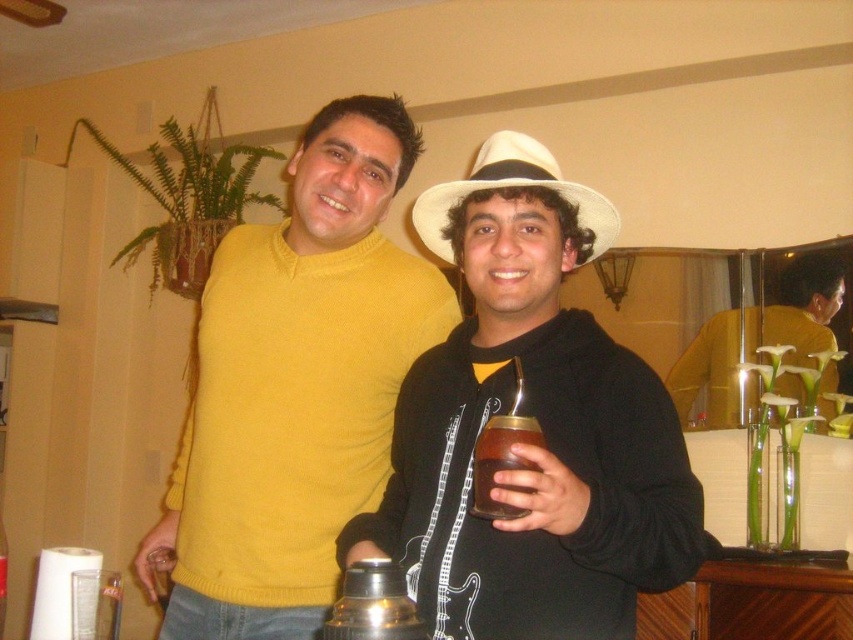
Can you confirm if matte yellow sweater at center is smaller than yellow sweater at center?

Incorrect, matte yellow sweater at center is not smaller in size than yellow sweater at center.

Describe the element at coordinates (294, 387) in the screenshot. I see `matte yellow sweater at center` at that location.

This screenshot has height=640, width=853. Identify the location of matte yellow sweater at center. (294, 387).

Between point (206, 422) and point (508, 468), which one is positioned behind?

The point (206, 422) is more distant.

Is point (404, 337) positioned after point (509, 419)?

That is True.

You are a GUI agent. You are given a task and a screenshot of the screen. Output one action in this format:
    pyautogui.click(x=<x>, y=<y>)
    Task: Click on the matte yellow sweater at center
    
    Given the screenshot: What is the action you would take?
    pyautogui.click(x=294, y=387)

Based on the photo, does white matte hat at center appear under white felt hat at center?

Yes.

The height and width of the screenshot is (640, 853). What do you see at coordinates (538, 422) in the screenshot?
I see `white matte hat at center` at bounding box center [538, 422].

Locate an element on the screen. The image size is (853, 640). white matte hat at center is located at coordinates (538, 422).